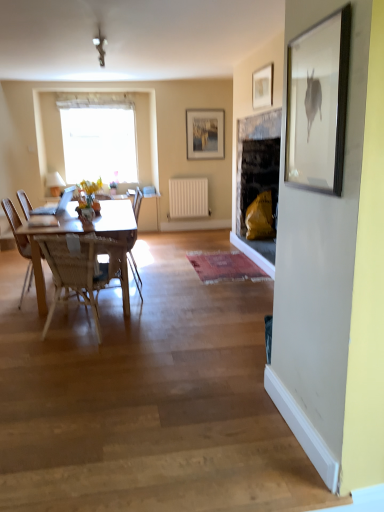
Question: Can you confirm if matte glass picture frame at upper center, the second picture frame from the front, is positioned to the right of white sheer curtain at upper center?

Choices:
 (A) yes
 (B) no

Answer: (A)

Question: Is matte glass picture frame at upper center, which appears as the first picture frame when viewed from the back, surrounding white sheer curtain at upper center?

Choices:
 (A) no
 (B) yes

Answer: (A)

Question: From the image's perspective, is matte glass picture frame at upper center, marked as the first picture frame in a left-to-right arrangement, beneath white sheer curtain at upper center?

Choices:
 (A) yes
 (B) no

Answer: (B)

Question: Is matte glass picture frame at upper center, marked as the first picture frame in a left-to-right arrangement, oriented towards white sheer curtain at upper center?

Choices:
 (A) yes
 (B) no

Answer: (B)

Question: From a real-world perspective, is matte glass picture frame at upper center, which appears as the first picture frame when viewed from the back, positioned over white sheer curtain at upper center based on gravity?

Choices:
 (A) no
 (B) yes

Answer: (B)

Question: Is white sheer curtain at upper center inside the boundaries of matte glass vase at center, or outside?

Choices:
 (A) outside
 (B) inside

Answer: (A)

Question: From a real-world perspective, is white sheer curtain at upper center positioned above or below matte glass vase at center?

Choices:
 (A) below
 (B) above

Answer: (B)

Question: Looking at the image, does white sheer curtain at upper center seem bigger or smaller compared to matte glass vase at center?

Choices:
 (A) big
 (B) small

Answer: (A)

Question: Considering the positions of white sheer curtain at upper center and matte glass vase at center in the image, is white sheer curtain at upper center wider or thinner than matte glass vase at center?

Choices:
 (A) thin
 (B) wide

Answer: (B)

Question: Is point (82, 215) positioned closer to the camera than point (87, 161)?

Choices:
 (A) closer
 (B) farther

Answer: (A)

Question: From the image's perspective, is matte glass vase at center positioned above or below white sheer curtain at upper center?

Choices:
 (A) below
 (B) above

Answer: (A)

Question: In the image, is matte glass vase at center positioned in front of or behind white sheer curtain at upper center?

Choices:
 (A) behind
 (B) front

Answer: (B)

Question: Is matte glass vase at center to the left or to the right of white sheer curtain at upper center in the image?

Choices:
 (A) right
 (B) left

Answer: (A)

Question: Is matte glass picture frame at upper center, the 2th picture frame when ordered from right to left, situated inside white matte radiator at center or outside?

Choices:
 (A) inside
 (B) outside

Answer: (B)

Question: Considering the positions of matte glass picture frame at upper center, the 2th picture frame when ordered from right to left, and white matte radiator at center in the image, is matte glass picture frame at upper center, the 2th picture frame when ordered from right to left, wider or thinner than white matte radiator at center?

Choices:
 (A) wide
 (B) thin

Answer: (B)